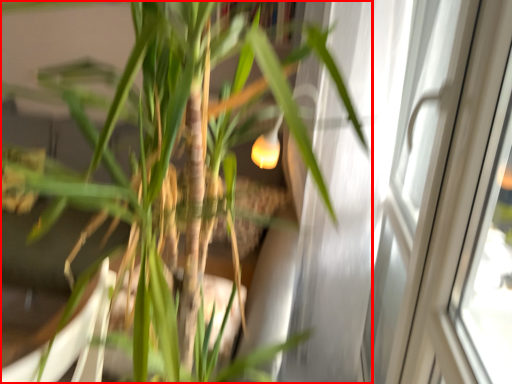
Question: From the image's perspective, where is houseplant (annotated by the red box) located relative to screen door?

Choices:
 (A) below
 (B) above

Answer: (A)